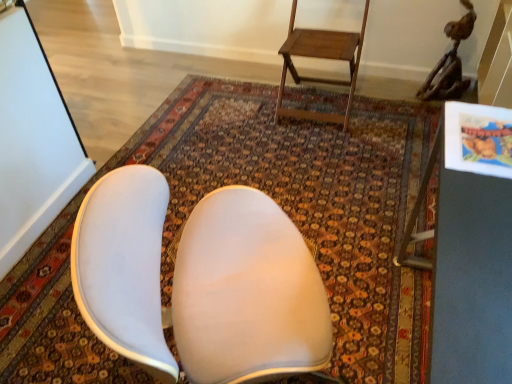
Question: Considering the relative sizes of metallic gray table at right and wooden step stool at upper center in the image provided, is metallic gray table at right shorter than wooden step stool at upper center?

Choices:
 (A) no
 (B) yes

Answer: (A)

Question: Can you confirm if metallic gray table at right is positioned to the right of wooden step stool at upper center?

Choices:
 (A) yes
 (B) no

Answer: (A)

Question: Is metallic gray table at right far from wooden step stool at upper center?

Choices:
 (A) no
 (B) yes

Answer: (B)

Question: Is wooden step stool at upper center located within metallic gray table at right?

Choices:
 (A) yes
 (B) no

Answer: (B)

Question: Is metallic gray table at right turned away from wooden step stool at upper center?

Choices:
 (A) no
 (B) yes

Answer: (A)

Question: From the image's perspective, is metallic gray table at right above wooden step stool at upper center?

Choices:
 (A) yes
 (B) no

Answer: (B)

Question: Is wooden step stool at upper center turned away from metallic gray table at right?

Choices:
 (A) yes
 (B) no

Answer: (B)

Question: Is wooden step stool at upper center smaller than metallic gray table at right?

Choices:
 (A) no
 (B) yes

Answer: (B)

Question: From a real-world perspective, is wooden step stool at upper center physically above metallic gray table at right?

Choices:
 (A) no
 (B) yes

Answer: (A)

Question: From the image's perspective, would you say wooden step stool at upper center is positioned over metallic gray table at right?

Choices:
 (A) no
 (B) yes

Answer: (B)

Question: Is wooden step stool at upper center not close to metallic gray table at right?

Choices:
 (A) no
 (B) yes

Answer: (B)

Question: Is wooden step stool at upper center positioned beyond the bounds of metallic gray table at right?

Choices:
 (A) yes
 (B) no

Answer: (A)

Question: Is carpeted rug at center further to camera compared to wooden step stool at upper center?

Choices:
 (A) yes
 (B) no

Answer: (B)